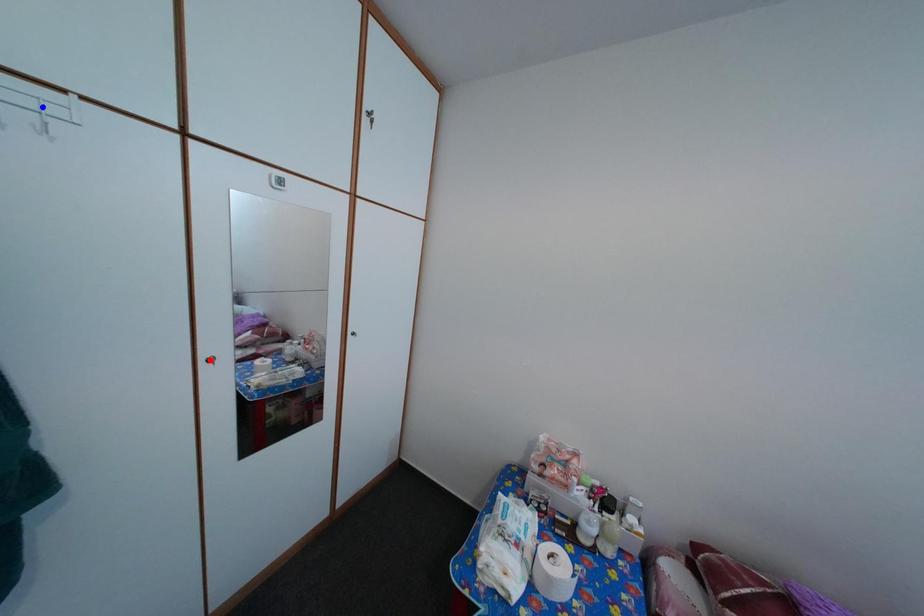
Question: In the image, two points are highlighted. Which point is nearer to the camera? Reply with the corresponding letter.

Choices:
 (A) blue point
 (B) red point

Answer: (A)